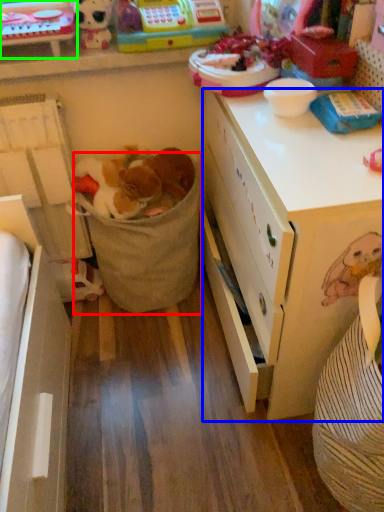
Question: Based on their relative distances, which object is farther from laundry basket (highlighted by a red box)? Choose from desk (highlighted by a blue box) and cabinetry (highlighted by a green box).

Choices:
 (A) desk
 (B) cabinetry

Answer: (B)